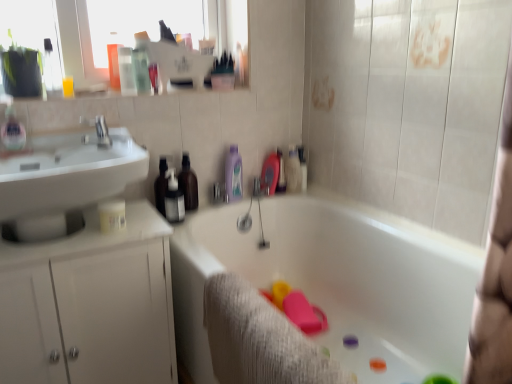
Question: Is brown matte bottle at center, which is the 1th toiletry from left to right, shorter than white glossy bathtub at center?

Choices:
 (A) yes
 (B) no

Answer: (A)

Question: Is brown matte bottle at center, marked as the 3th toiletry in a right-to-left arrangement, facing towards white glossy bathtub at center?

Choices:
 (A) no
 (B) yes

Answer: (A)

Question: Does brown matte bottle at center, marked as the 3th toiletry in a right-to-left arrangement, have a greater height compared to white glossy bathtub at center?

Choices:
 (A) no
 (B) yes

Answer: (A)

Question: Can you confirm if brown matte bottle at center, which is the 1th toiletry from left to right, is positioned to the right of white glossy bathtub at center?

Choices:
 (A) no
 (B) yes

Answer: (A)

Question: From the image's perspective, would you say brown matte bottle at center, marked as the 3th toiletry in a right-to-left arrangement, is positioned over white glossy bathtub at center?

Choices:
 (A) yes
 (B) no

Answer: (A)

Question: Is the position of brown matte bottle at center, marked as the 3th toiletry in a right-to-left arrangement, less distant than that of white glossy bathtub at center?

Choices:
 (A) no
 (B) yes

Answer: (A)

Question: From the image's perspective, would you say translucent plastic soap dispenser at left is shown under white glossy cabinet at left?

Choices:
 (A) no
 (B) yes

Answer: (A)

Question: From the image's perspective, is translucent plastic soap dispenser at left on white glossy cabinet at left?

Choices:
 (A) no
 (B) yes

Answer: (B)

Question: Would you say translucent plastic soap dispenser at left is a long distance from white glossy cabinet at left?

Choices:
 (A) yes
 (B) no

Answer: (B)

Question: Is translucent plastic soap dispenser at left at the left side of white glossy cabinet at left?

Choices:
 (A) yes
 (B) no

Answer: (A)

Question: Does translucent plastic soap dispenser at left have a lesser height compared to white glossy cabinet at left?

Choices:
 (A) yes
 (B) no

Answer: (A)

Question: From a real-world perspective, is translucent plastic soap dispenser at left on top of white glossy cabinet at left?

Choices:
 (A) no
 (B) yes

Answer: (B)

Question: Is white glossy bathtub at center turned away from white glossy cabinet at left?

Choices:
 (A) no
 (B) yes

Answer: (A)